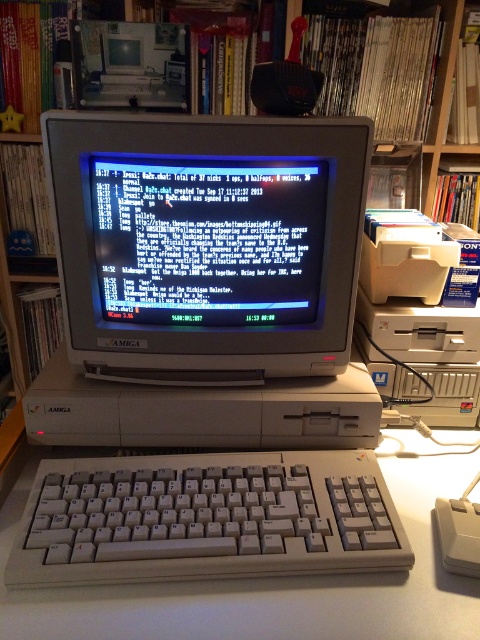
Between white plastic keyboard at lower center and black matte monitor at center, which one has less height?

With less height is white plastic keyboard at lower center.

Is white plastic keyboard at lower center thinner than black matte monitor at center?

No, white plastic keyboard at lower center is not thinner than black matte monitor at center.

Who is more distant from viewer, (283, 461) or (187, 182)?

The point (283, 461) is behind.

The height and width of the screenshot is (640, 480). In order to click on white plastic keyboard at lower center in this screenshot , I will do `click(205, 518)`.

Is white plastic keyboard at lower center below white plastic mouse at lower right?

No.

Is white plastic keyboard at lower center smaller than white plastic mouse at lower right?

Actually, white plastic keyboard at lower center might be larger than white plastic mouse at lower right.

Between point (50, 540) and point (448, 500), which one is positioned in front?

Point (50, 540)

Where is `white plastic keyboard at lower center`? This screenshot has height=640, width=480. white plastic keyboard at lower center is located at coordinates (205, 518).

Which of these two, black matte monitor at center or white plastic mouse at lower right, stands taller?

Standing taller between the two is black matte monitor at center.

Is point (162, 227) positioned behind point (459, 532)?

Yes.

Is point (250, 284) less distant than point (445, 513)?

No, it is behind (445, 513).

This screenshot has height=640, width=480. I want to click on black matte monitor at center, so click(x=207, y=240).